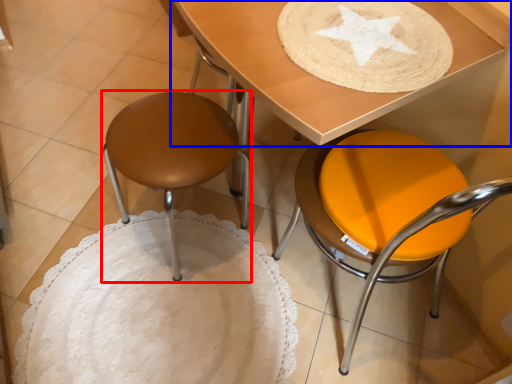
Question: Among these objects, which one is nearest to the camera, stool (highlighted by a red box) or table (highlighted by a blue box)?

Choices:
 (A) stool
 (B) table

Answer: (B)